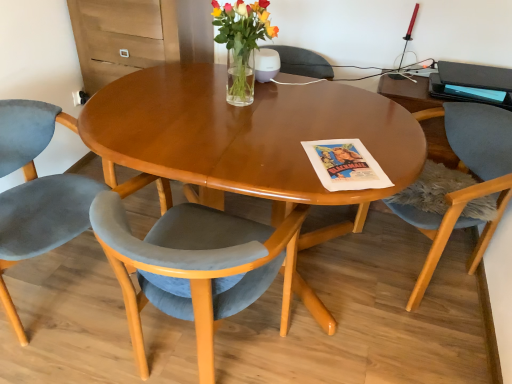
Question: Considering the relative positions of velvet grey chair at lower left, placed as the second chair when sorted from right to left, and matte black magazine at upper right in the image provided, is velvet grey chair at lower left, placed as the second chair when sorted from right to left, to the left or to the right of matte black magazine at upper right?

Choices:
 (A) right
 (B) left

Answer: (B)

Question: In terms of height, does velvet grey chair at lower left, placed as the second chair when sorted from right to left, look taller or shorter compared to matte black magazine at upper right?

Choices:
 (A) tall
 (B) short

Answer: (A)

Question: Which is nearer to the velvet grey chair at lower left, the third chair viewed from the right?

Choices:
 (A) velvet blue chair at lower right, which is the first chair in right-to-left order
 (B) translucent glass vase at center
 (C) velvet grey chair at lower left, placed as the second chair when sorted from right to left
 (D) matte black magazine at upper right

Answer: (C)

Question: Based on their relative distances, which object is nearer to the velvet grey chair at lower left, which is the 1th chair in left-to-right order?

Choices:
 (A) velvet grey chair at lower left, placed as the second chair when sorted from right to left
 (B) matte black magazine at upper right
 (C) velvet blue chair at lower right, which is the first chair in right-to-left order
 (D) translucent glass vase at center

Answer: (A)